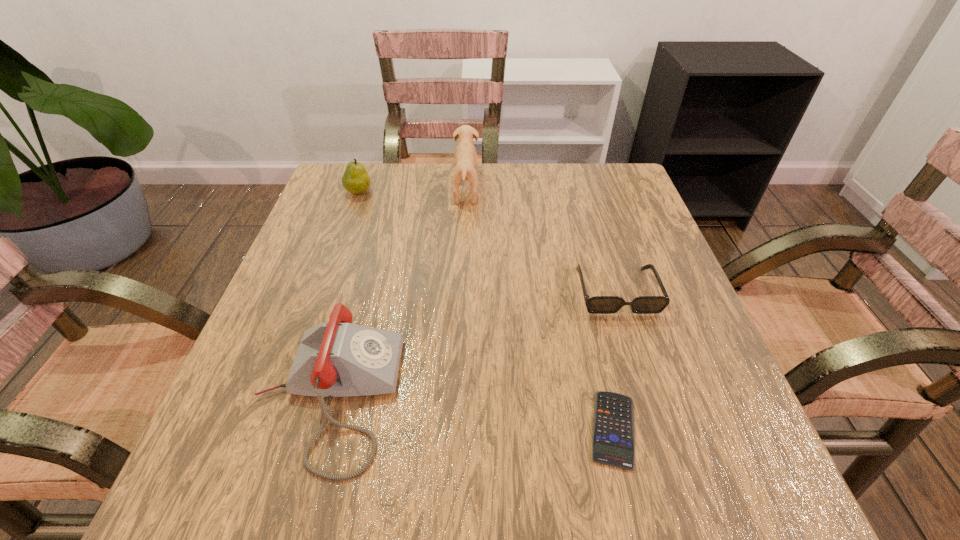
At what (x,y) coordinates should I click in order to perform the action: click on free region that satisfies the following two spatial constraints: 1. on the front-facing side of the second shortest object; 2. on the dial of the telephone. Please return your answer as a coordinate pair (x, y). The height and width of the screenshot is (540, 960). Looking at the image, I should click on (649, 396).

Where is `free space that satisfies the following two spatial constraints: 1. on the dial of the telephone; 2. on the right side of the calculator`? free space that satisfies the following two spatial constraints: 1. on the dial of the telephone; 2. on the right side of the calculator is located at coordinates (318, 429).

Image resolution: width=960 pixels, height=540 pixels. Identify the location of free space in the image that satisfies the following two spatial constraints: 1. on the left side of the puppy; 2. on the right side of the calculator. (456, 429).

Locate an element on the screen. vacant space that satisfies the following two spatial constraints: 1. on the front-facing side of the sunglasses; 2. on the dial of the telephone is located at coordinates (649, 396).

Locate an element on the screen. free space in the image that satisfies the following two spatial constraints: 1. on the left side of the calculator; 2. on the right side of the third object from right to left is located at coordinates (x=456, y=429).

Identify the location of free region that satisfies the following two spatial constraints: 1. on the left side of the tallest object; 2. on the front side of the pear. The image size is (960, 540). (466, 192).